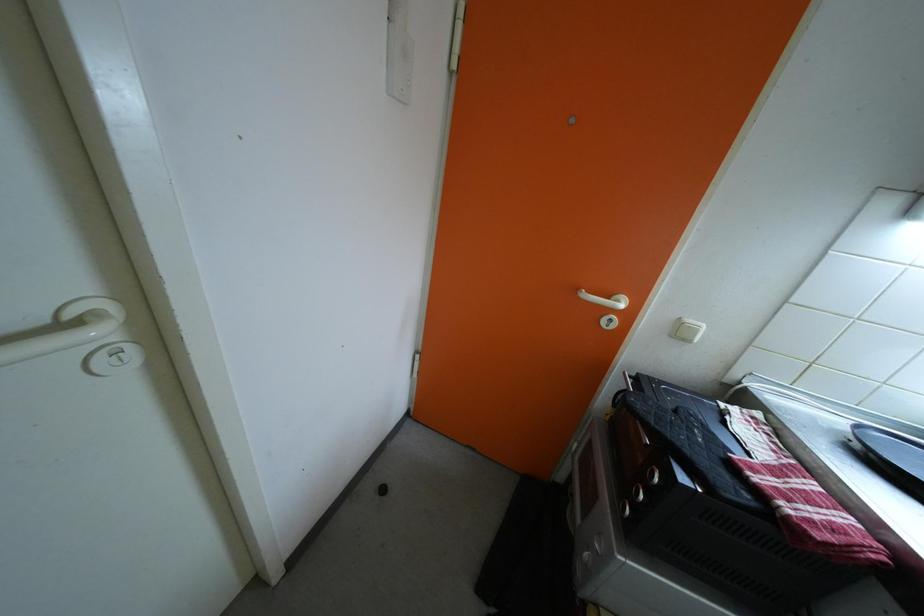
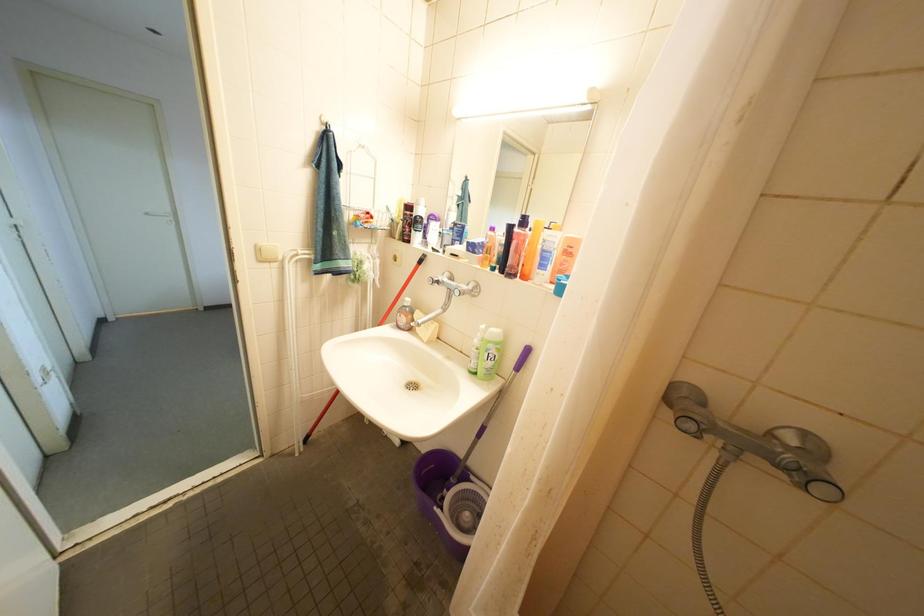
Question: The images are taken continuously from a first-person perspective. In which direction are you moving?

Choices:
 (A) Left
 (B) Right
 (C) Forward
 (D) Backward

Answer: (B)